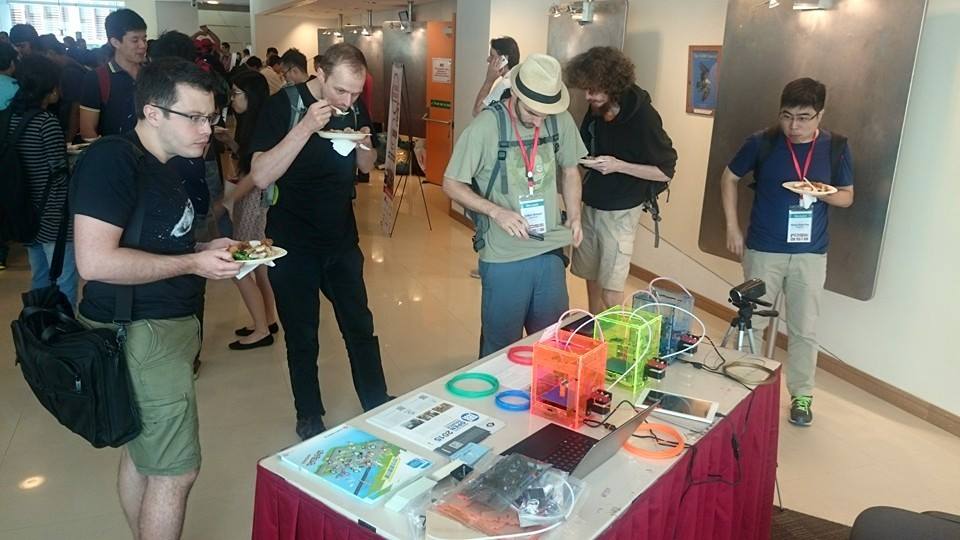
This screenshot has width=960, height=540. Identify the location of metal wall display. (812, 54), (572, 36), (408, 57), (371, 46), (321, 43).